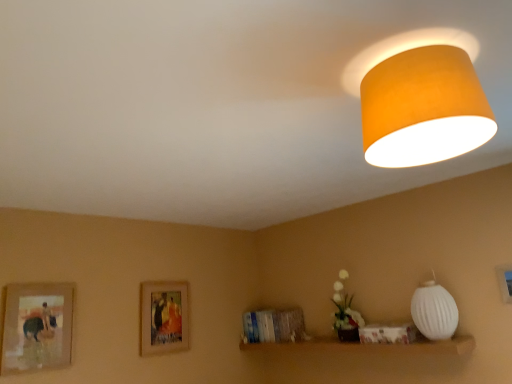
The image size is (512, 384). Describe the element at coordinates (505, 282) in the screenshot. I see `matte wooden picture frame at lower right, the 3th picture frame when ordered from left to right` at that location.

This screenshot has height=384, width=512. What do you see at coordinates (163, 317) in the screenshot? I see `wooden framed picture at center, placed as the 3th picture frame when sorted from front to back` at bounding box center [163, 317].

Find the location of `matte wooden picture frame at lower right, the 3th picture frame when ordered from left to right`. matte wooden picture frame at lower right, the 3th picture frame when ordered from left to right is located at coordinates (505, 282).

Are white matte vase at lower center and white ribbed lampshade at right, placed as the first lamp when sorted from bottom to top, located far from each other?

white matte vase at lower center is actually quite close to white ribbed lampshade at right, placed as the first lamp when sorted from bottom to top.

Can we say white matte vase at lower center lies outside white ribbed lampshade at right, which is the 2th lamp from front to back?

Absolutely, white matte vase at lower center is external to white ribbed lampshade at right, which is the 2th lamp from front to back.

Which of these two, white matte vase at lower center or white ribbed lampshade at right, marked as the second lamp in a top-to-bottom arrangement, is thinner?

white matte vase at lower center.

Looking at this image, who is bigger, white matte vase at lower center or white ribbed lampshade at right, the 1th lamp from the back?

white ribbed lampshade at right, the 1th lamp from the back.

I want to click on the 2nd lamp to the right of the wooden framed picture at center, the first picture frame in the back-to-front sequence, counting from the anchor's position, so click(x=434, y=311).

From the image's perspective, relative to white ribbed lampshade at right, which is the 2th lamp from front to back, is wooden framed picture at center, the first picture frame in the back-to-front sequence, above or below?

Clearly, from the image's perspective, wooden framed picture at center, the first picture frame in the back-to-front sequence, is below white ribbed lampshade at right, which is the 2th lamp from front to back.

Between wooden framed picture at center, placed as the 3th picture frame when sorted from front to back, and white ribbed lampshade at right, placed as the first lamp when sorted from bottom to top, which one has smaller width?

With smaller width is wooden framed picture at center, placed as the 3th picture frame when sorted from front to back.

In the scene shown: Between wooden framed picture at center, which appears as the 2th picture frame when viewed from the left, and white ribbed lampshade at right, marked as the second lamp in a top-to-bottom arrangement, which one has less height?

white ribbed lampshade at right, marked as the second lamp in a top-to-bottom arrangement.

Considering the sizes of white ribbed lampshade at right, which is the 2th lamp from front to back, and white matte vase at lower center in the image, is white ribbed lampshade at right, which is the 2th lamp from front to back, taller or shorter than white matte vase at lower center?

In the image, white ribbed lampshade at right, which is the 2th lamp from front to back, appears to be shorter than white matte vase at lower center.

Based on the photo, is white ribbed lampshade at right, marked as the second lamp in a top-to-bottom arrangement, directly adjacent to white matte vase at lower center?

They are not placed beside each other.

Is white ribbed lampshade at right, the 2th lamp positioned from the left, facing away from white matte vase at lower center?

white ribbed lampshade at right, the 2th lamp positioned from the left, does not have its back to white matte vase at lower center.

Which of these two, white ribbed lampshade at right, placed as the first lamp when sorted from bottom to top, or white matte vase at lower center, is bigger?

white ribbed lampshade at right, placed as the first lamp when sorted from bottom to top, is bigger.

Can you confirm if matte wooden picture frame at lower right, which is the first picture frame from front to back, is positioned to the left of orange fabric lampshade at upper right, which is the second lamp in bottom-to-top order?

No, matte wooden picture frame at lower right, which is the first picture frame from front to back, is not to the left of orange fabric lampshade at upper right, which is the second lamp in bottom-to-top order.

Can you tell me how much matte wooden picture frame at lower right, which is the first picture frame from front to back, and orange fabric lampshade at upper right, the 2th lamp viewed from the back, differ in facing direction?

0.00209 degrees separate the facing orientations of matte wooden picture frame at lower right, which is the first picture frame from front to back, and orange fabric lampshade at upper right, the 2th lamp viewed from the back.

Does matte wooden picture frame at lower right, the 1th picture frame positioned from the right, contain orange fabric lampshade at upper right, which is the second lamp in bottom-to-top order?

Actually, orange fabric lampshade at upper right, which is the second lamp in bottom-to-top order, is outside matte wooden picture frame at lower right, the 1th picture frame positioned from the right.

Consider the image. Is wooden framed picture at left, positioned as the 3th picture frame in right-to-left order, far from white matte vase at lower center?

Absolutely, wooden framed picture at left, positioned as the 3th picture frame in right-to-left order, is distant from white matte vase at lower center.

Considering the relative sizes of wooden framed picture at left, positioned as the 3th picture frame in right-to-left order, and white matte vase at lower center in the image provided, is wooden framed picture at left, positioned as the 3th picture frame in right-to-left order, wider than white matte vase at lower center?

In fact, wooden framed picture at left, positioned as the 3th picture frame in right-to-left order, might be narrower than white matte vase at lower center.

From the image's perspective, is wooden framed picture at left, the 1th picture frame positioned from the left, positioned above or below white matte vase at lower center?

Clearly, from the image's perspective, wooden framed picture at left, the 1th picture frame positioned from the left, is below white matte vase at lower center.

Can you confirm if white ribbed lampshade at right, which is the 2th lamp from front to back, is taller than wooden framed picture at left, the second picture frame when ordered from front to back?

No.

Is there a large distance between white ribbed lampshade at right, marked as the second lamp in a top-to-bottom arrangement, and wooden framed picture at left, positioned as the 3th picture frame in right-to-left order?

Yes, white ribbed lampshade at right, marked as the second lamp in a top-to-bottom arrangement, and wooden framed picture at left, positioned as the 3th picture frame in right-to-left order, are quite far apart.

From the image's perspective, is white ribbed lampshade at right, placed as the first lamp when sorted from bottom to top, located above wooden framed picture at left, the 1th picture frame positioned from the left?

Yes, from the image's perspective, white ribbed lampshade at right, placed as the first lamp when sorted from bottom to top, is above wooden framed picture at left, the 1th picture frame positioned from the left.

Is wooden framed picture at center, the first picture frame in the back-to-front sequence, in contact with matte wooden picture frame at lower right, the third picture frame positioned from the back?

No, wooden framed picture at center, the first picture frame in the back-to-front sequence, is not making contact with matte wooden picture frame at lower right, the third picture frame positioned from the back.

Is wooden framed picture at center, placed as the 3th picture frame when sorted from front to back, at the left side of matte wooden picture frame at lower right, the third picture frame positioned from the back?

Yes, wooden framed picture at center, placed as the 3th picture frame when sorted from front to back, is to the left of matte wooden picture frame at lower right, the third picture frame positioned from the back.

Considering the points (161, 284) and (506, 295), which point is in front, point (161, 284) or point (506, 295)?

Positioned in front is point (506, 295).

Where is `lamp that is the 1st object located above the white matte vase at lower center (from the image's perspective)`? lamp that is the 1st object located above the white matte vase at lower center (from the image's perspective) is located at coordinates (434, 311).

Which picture frame is the 2nd one when counting from the back of the white ribbed lampshade at right, which is the 2th lamp from front to back? Please provide its 2D coordinates.

[(163, 317)]

From the picture: Which object lies further to the anchor point matte wooden picture frame at lower right, the third picture frame positioned from the back, white matte vase at lower center or orange fabric lampshade at upper right, the 2th lamp viewed from the back?

Based on the image, orange fabric lampshade at upper right, the 2th lamp viewed from the back, appears to be further to matte wooden picture frame at lower right, the third picture frame positioned from the back.

Considering their positions, is wooden framed picture at left, the second picture frame when ordered from front to back, positioned closer to white ribbed lampshade at right, placed as the first lamp when sorted from bottom to top, than white matte vase at lower center?

Based on the image, white matte vase at lower center appears to be nearer to white ribbed lampshade at right, placed as the first lamp when sorted from bottom to top.

From the image, which object appears to be farther from white ribbed lampshade at right, the 2th lamp positioned from the left, wooden framed picture at left, positioned as the 3th picture frame in right-to-left order, or orange fabric lampshade at upper right, which is counted as the 1th lamp, starting from the front?

wooden framed picture at left, positioned as the 3th picture frame in right-to-left order.

Estimate the real-world distances between objects in this image. Which object is closer to white matte vase at lower center, matte wooden picture frame at lower right, which is the first picture frame from front to back, or wooden framed picture at center, placed as the 3th picture frame when sorted from front to back?

matte wooden picture frame at lower right, which is the first picture frame from front to back, lies closer to white matte vase at lower center than the other object.

Looking at the image, which one is located closer to orange fabric lampshade at upper right, which is counted as the 1th lamp, starting from the front, wooden framed picture at left, positioned as the 3th picture frame in right-to-left order, or white matte vase at lower center?

Among the two, white matte vase at lower center is located nearer to orange fabric lampshade at upper right, which is counted as the 1th lamp, starting from the front.

Looking at the image, which one is located closer to wooden framed picture at center, the first picture frame in the back-to-front sequence, wooden framed picture at left, the 1th picture frame positioned from the left, or white matte vase at lower center?

The object closer to wooden framed picture at center, the first picture frame in the back-to-front sequence, is wooden framed picture at left, the 1th picture frame positioned from the left.

Which object lies further to the anchor point matte wooden picture frame at lower right, the 1th picture frame positioned from the right, orange fabric lampshade at upper right, marked as the first lamp in a left-to-right arrangement, or wooden framed picture at left, positioned as the 3th picture frame in right-to-left order?

wooden framed picture at left, positioned as the 3th picture frame in right-to-left order, is further to matte wooden picture frame at lower right, the 1th picture frame positioned from the right.

From the image, which object appears to be farther from white matte vase at lower center, wooden framed picture at left, marked as the 2th picture frame in a back-to-front arrangement, or white ribbed lampshade at right, the 2th lamp positioned from the left?

Based on the image, wooden framed picture at left, marked as the 2th picture frame in a back-to-front arrangement, appears to be further to white matte vase at lower center.

Identify the location of flower located between wooden framed picture at center, arranged as the 2th picture frame when viewed from the right, and white ribbed lampshade at right, the 2th lamp positioned from the left, in the left-right direction. This screenshot has height=384, width=512. 344,306.

You are a GUI agent. You are given a task and a screenshot of the screen. Output one action in this format:
    pyautogui.click(x=<x>, y=<y>)
    Task: Click on the lamp situated between wooden framed picture at left, the 1th picture frame positioned from the left, and white ribbed lampshade at right, which is the first lamp from right to left, from left to right
    Image resolution: width=512 pixels, height=384 pixels.
    Given the screenshot: What is the action you would take?
    pyautogui.click(x=423, y=108)

Where is `picture frame between wooden framed picture at left, marked as the 2th picture frame in a back-to-front arrangement, and matte wooden picture frame at lower right, which is the first picture frame from front to back`? picture frame between wooden framed picture at left, marked as the 2th picture frame in a back-to-front arrangement, and matte wooden picture frame at lower right, which is the first picture frame from front to back is located at coordinates point(163,317).

You are a GUI agent. You are given a task and a screenshot of the screen. Output one action in this format:
    pyautogui.click(x=<x>, y=<y>)
    Task: Click on the lamp between white matte vase at lower center and matte wooden picture frame at lower right, the 1th picture frame positioned from the right, from left to right
    The height and width of the screenshot is (384, 512).
    Given the screenshot: What is the action you would take?
    pyautogui.click(x=434, y=311)